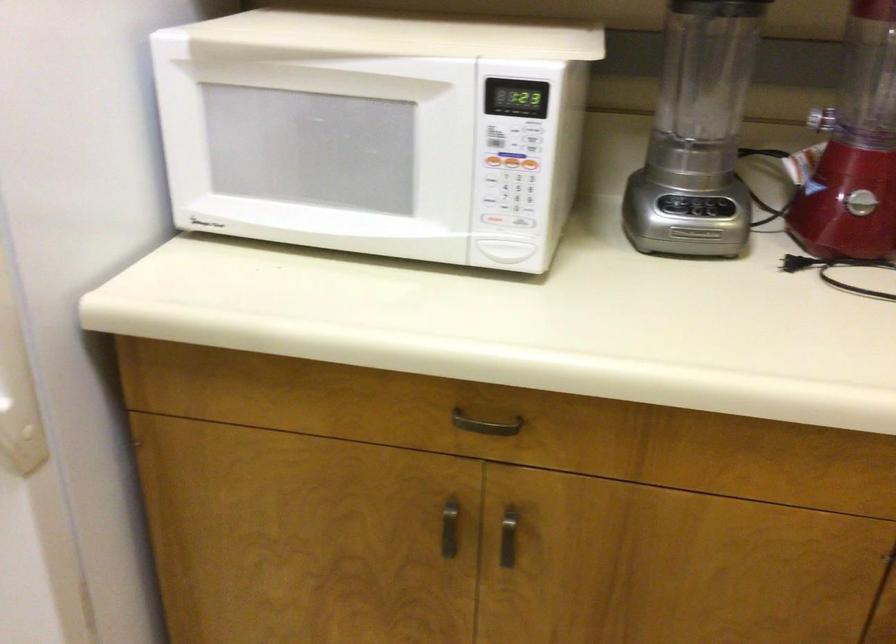
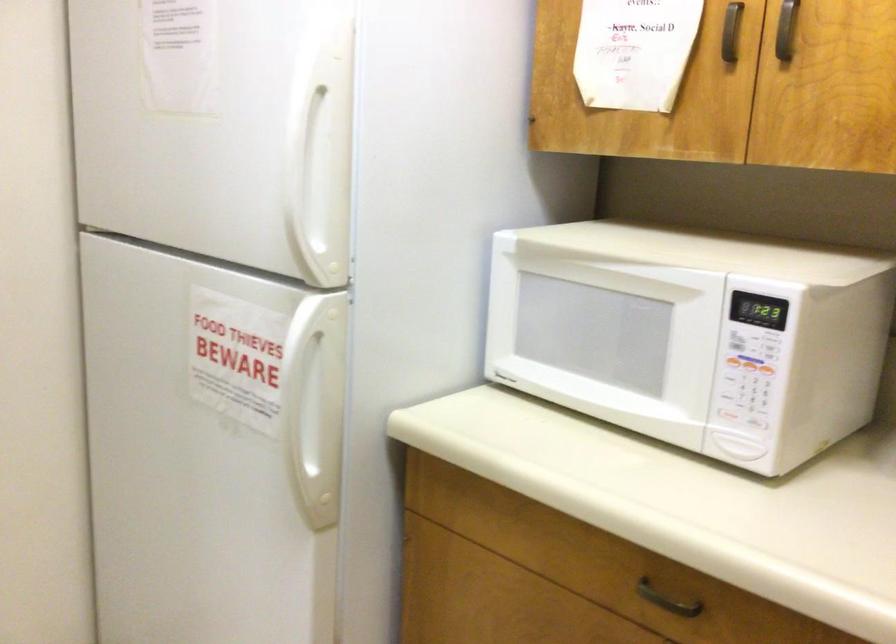
Question: The images are taken continuously from a first-person perspective. In which direction is your viewpoint rotating?

Choices:
 (A) Left
 (B) Right
 (C) Up
 (D) Down

Answer: (A)